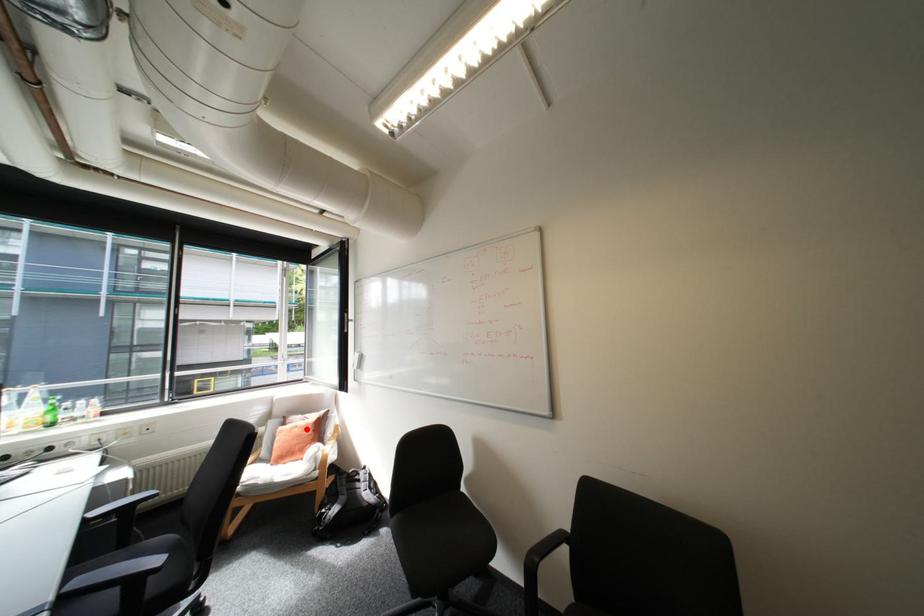
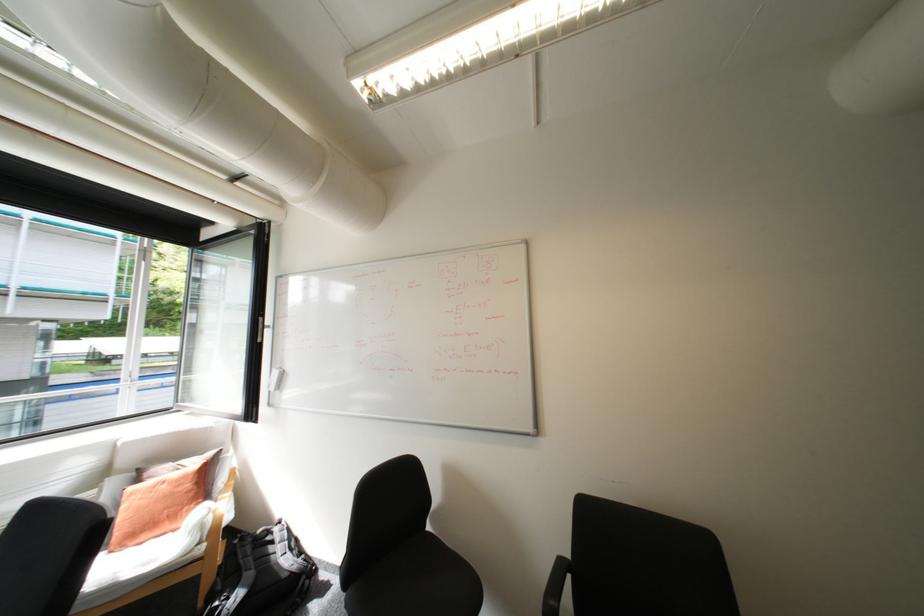
Find the pixel in the second image that matches the highlighted location in the first image.

(175, 485)